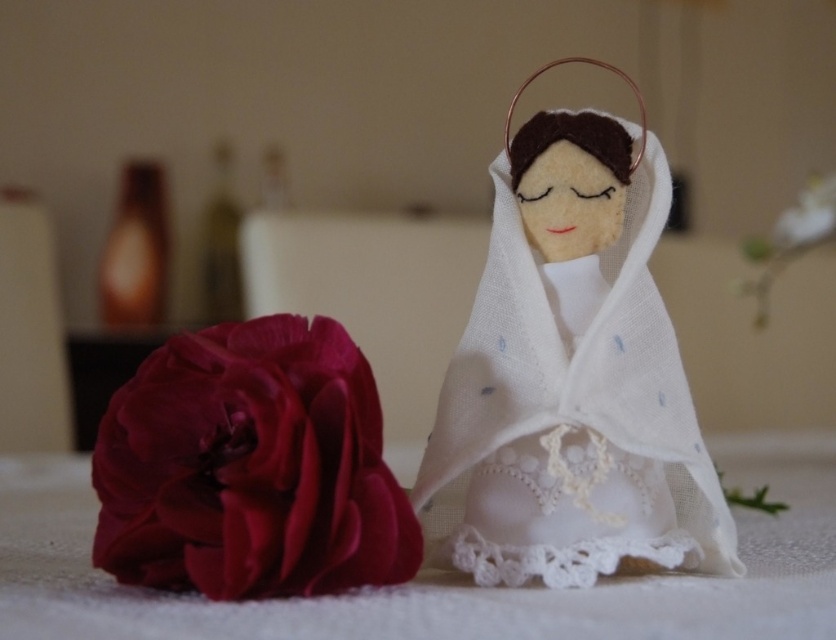
Question: Is white felt/linen robe at center closer to camera compared to matte silk rose at lower left?

Choices:
 (A) no
 (B) yes

Answer: (A)

Question: Does white felt/linen robe at center have a lesser width compared to matte silk rose at lower left?

Choices:
 (A) no
 (B) yes

Answer: (A)

Question: Where is white felt/linen robe at center located in relation to matte silk rose at lower left in the image?

Choices:
 (A) below
 (B) above

Answer: (B)

Question: Which point is closer to the camera?

Choices:
 (A) white felt/linen robe at center
 (B) matte silk rose at lower left

Answer: (B)

Question: Which point is farther to the camera?

Choices:
 (A) (493, 381)
 (B) (146, 477)

Answer: (A)